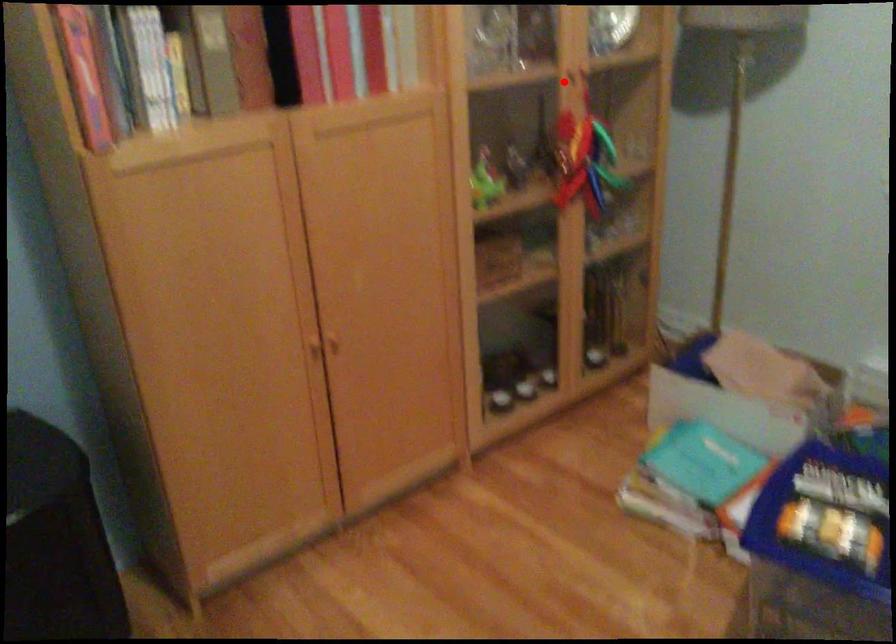
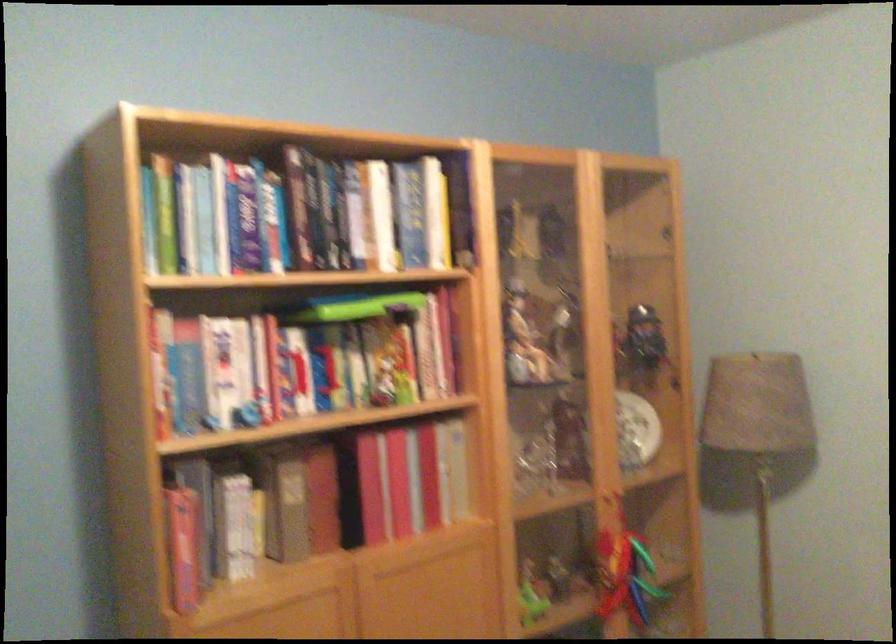
Find the pixel in the second image that matches the highlighted location in the first image.

(605, 500)